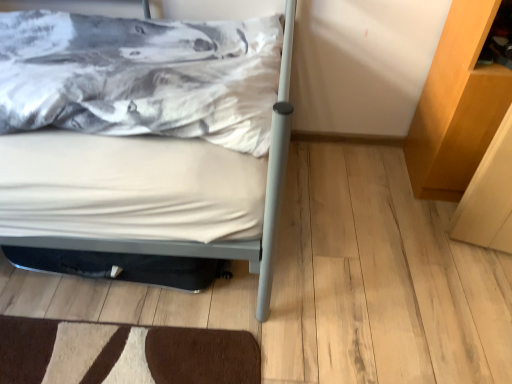
I want to click on white matte bed at upper left, so click(x=220, y=242).

Image resolution: width=512 pixels, height=384 pixels. Describe the element at coordinates (220, 242) in the screenshot. I see `white matte bed at upper left` at that location.

The image size is (512, 384). Find the location of `white matte bed at upper left`. white matte bed at upper left is located at coordinates (220, 242).